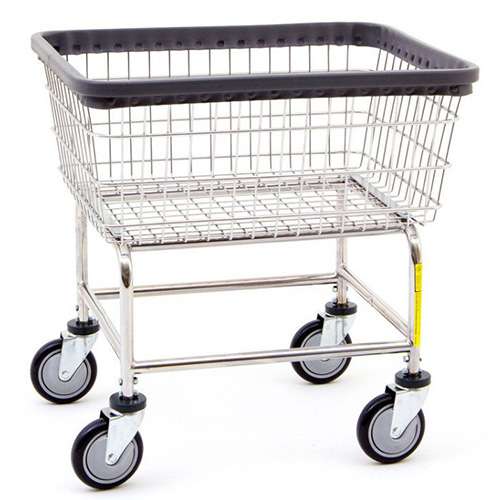
I want to click on floor, so click(237, 407).